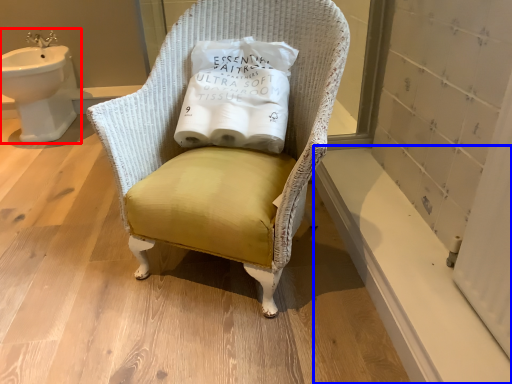
Question: Among these objects, which one is nearest to the camera, sink (highlighted by a red box) or window sill (highlighted by a blue box)?

Choices:
 (A) sink
 (B) window sill

Answer: (B)